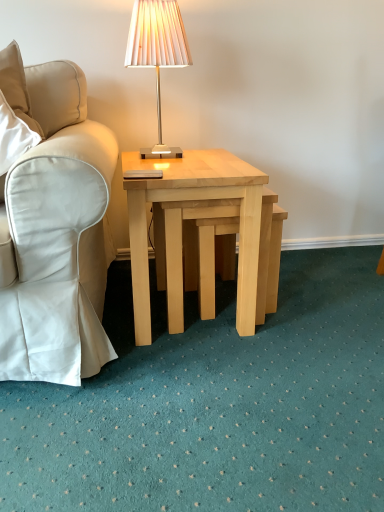
Where is `vacant area to the right of natural wood stool at center`? Image resolution: width=384 pixels, height=512 pixels. vacant area to the right of natural wood stool at center is located at coordinates (314, 298).